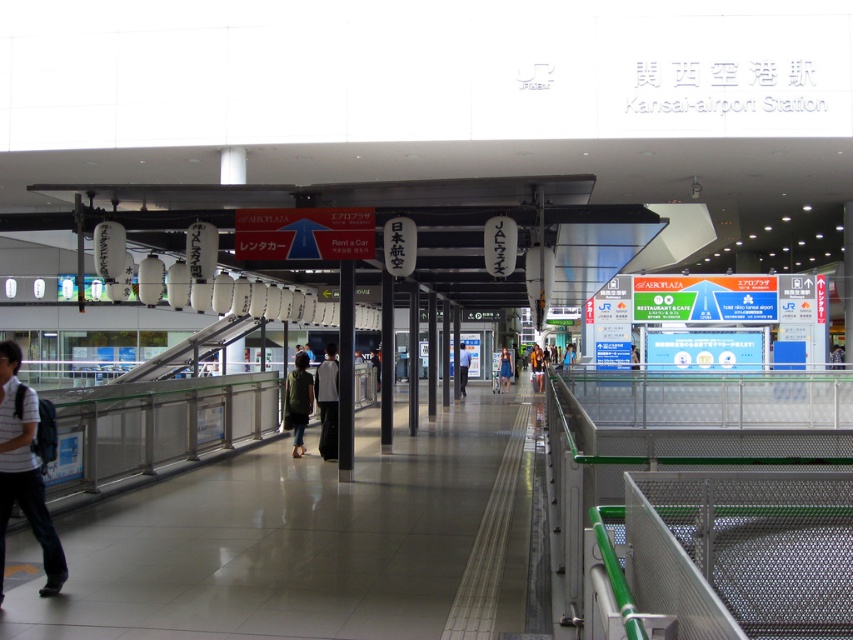
Find the location of a particular element. green fabric shirt at center is located at coordinates (299, 401).

Does green fabric shirt at center have a lesser height compared to light blue shirt at center?

Correct, green fabric shirt at center is not as tall as light blue shirt at center.

Who is more distant from viewer, (299, 380) or (467, 353)?

Point (467, 353)

The image size is (853, 640). In order to click on green fabric shirt at center in this screenshot , I will do `click(299, 401)`.

In the scene shown: Can you confirm if orange fabric backpack at center is positioned to the right of blue fabric dress at center?

Yes, orange fabric backpack at center is to the right of blue fabric dress at center.

Find the location of a particular element. orange fabric backpack at center is located at coordinates (537, 368).

At what (x,y) coordinates should I click in order to perform the action: click on orange fabric backpack at center. Please return your answer as a coordinate pair (x, y). The image size is (853, 640). Looking at the image, I should click on (537, 368).

Does green fabric shirt at center appear over blue fabric dress at center?

Correct, green fabric shirt at center is located above blue fabric dress at center.

Can you confirm if green fabric shirt at center is taller than blue fabric dress at center?

Yes, green fabric shirt at center is taller than blue fabric dress at center.

Is point (293, 394) behind point (502, 381)?

No.

I want to click on green fabric shirt at center, so click(x=299, y=401).